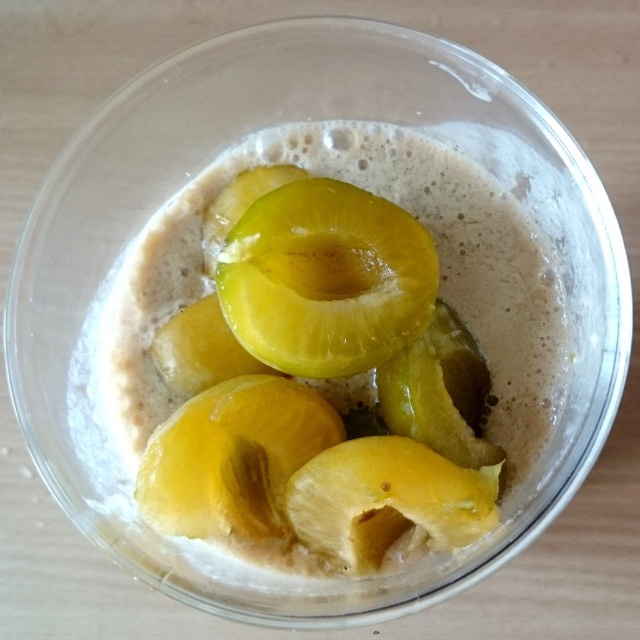
Question: Which point is farther from the camera taking this photo?

Choices:
 (A) (250, 262)
 (B) (228, 520)

Answer: (A)

Question: Can you confirm if translucent yellow fruit at center is wider than yellow matte fruit at center?

Choices:
 (A) yes
 (B) no

Answer: (A)

Question: Does translucent yellow fruit at center appear over yellow matte fruit at center?

Choices:
 (A) yes
 (B) no

Answer: (A)

Question: From the image, what is the correct spatial relationship of yellow translucent plum at center in relation to yellow matte fruit at center?

Choices:
 (A) right
 (B) left

Answer: (B)

Question: Among these points, which one is nearest to the camera?

Choices:
 (A) (422, 296)
 (B) (253, 468)

Answer: (A)

Question: Among these points, which one is farthest from the camera?

Choices:
 (A) (349, 522)
 (B) (304, 337)
 (C) (429, 259)

Answer: (C)